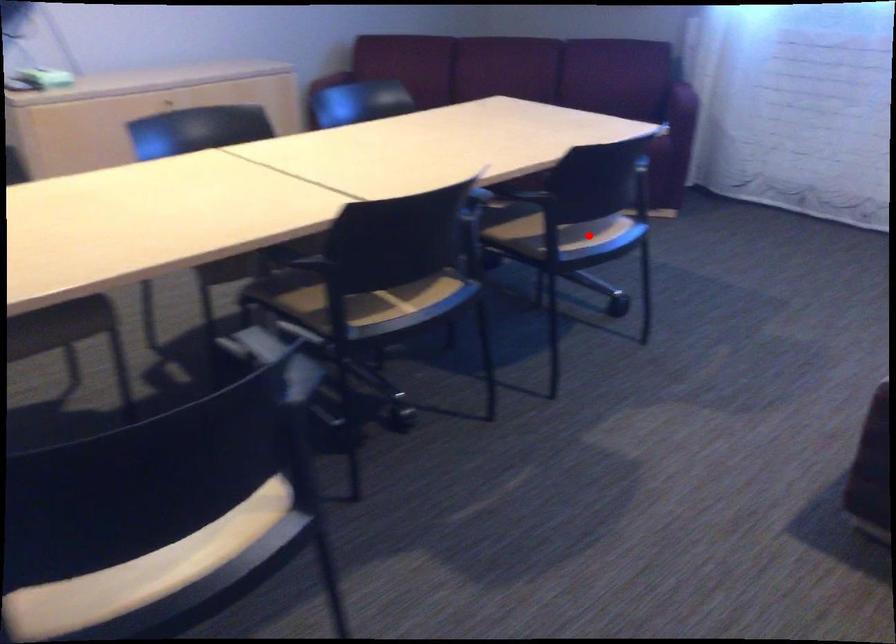
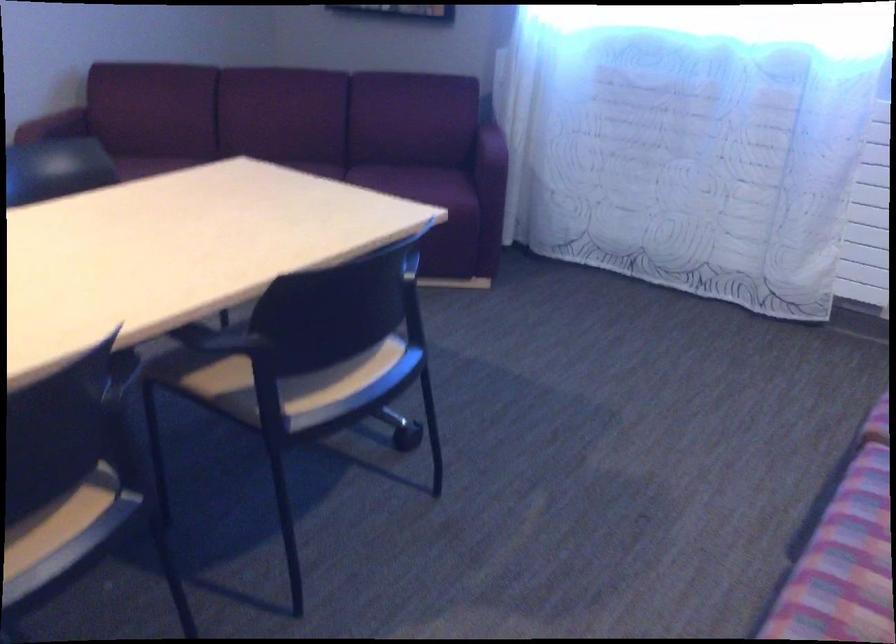
In the second image, find the point that corresponds to the highlighted location in the first image.

(328, 382)